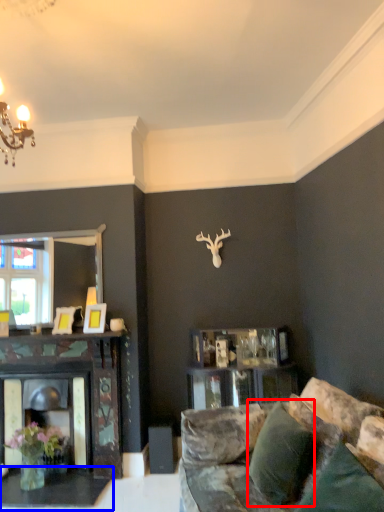
Question: Which of the following is the closest to the observer, pillow (highlighted by a red box) or table (highlighted by a blue box)?

Choices:
 (A) pillow
 (B) table

Answer: (A)